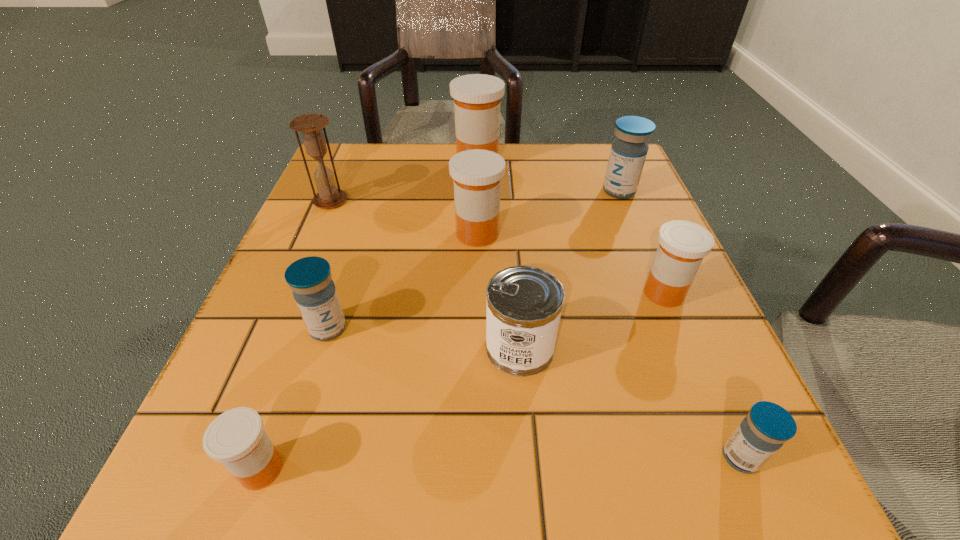
In order to click on the second smallest blue medicine in this screenshot , I will do [315, 294].

Where is `can`? The height and width of the screenshot is (540, 960). can is located at coordinates (524, 303).

Where is `the smallest blue medicine`? The height and width of the screenshot is (540, 960). the smallest blue medicine is located at coordinates (765, 429).

Locate an element on the screen. The width and height of the screenshot is (960, 540). the smallest orange medicine is located at coordinates (236, 438).

I want to click on the leftmost orange medicine, so click(236, 438).

Identify the location of blank area located 0.130m on the label of the farthest orange medicine. (558, 163).

I want to click on free spot located on the right of the hourglass, so click(x=434, y=200).

Image resolution: width=960 pixels, height=540 pixels. Identify the location of vacant position located on the label of the third nearest orange medicine. (645, 234).

At what (x,y) coordinates should I click in order to perform the action: click on free region located on the front of the sixth nearest medicine. Please return your answer as a coordinate pair (x, y). This screenshot has height=540, width=960. Looking at the image, I should click on (677, 334).

What are the coordinates of `vacant region located 0.260m on the label of the second smallest orange medicine` in the screenshot? It's located at (482, 293).